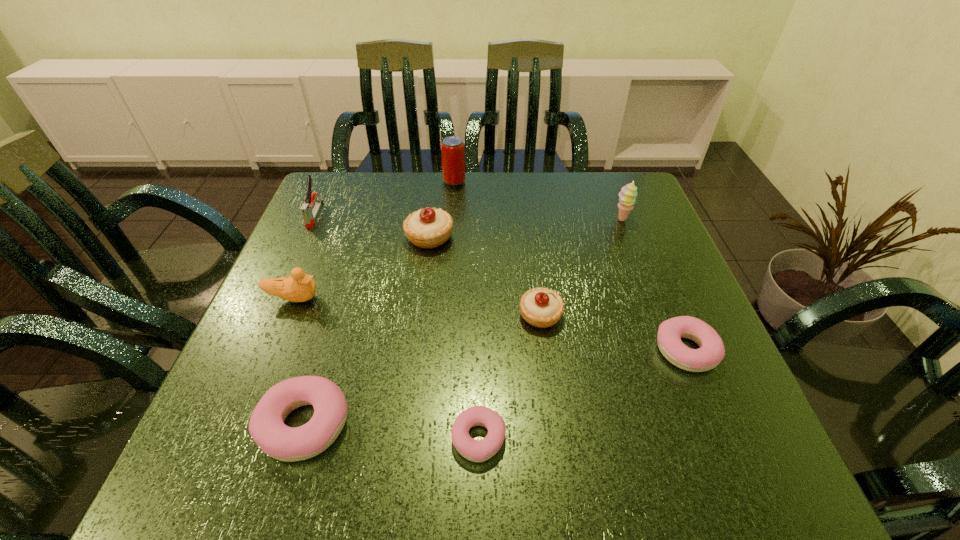
The image size is (960, 540). I want to click on vacant space located 0.110m on the right of the seventh object from left to right, so click(x=615, y=315).

Locate an element on the screen. This screenshot has width=960, height=540. free space located 0.290m on the back of the leftmost pastry is located at coordinates [x=350, y=275].

This screenshot has width=960, height=540. In order to click on blank space located on the left of the rightmost pink pastry in this screenshot , I will do `click(519, 350)`.

Identify the location of vacant area located 0.380m on the left of the shortest object. Image resolution: width=960 pixels, height=540 pixels. (218, 438).

The image size is (960, 540). Identify the location of beer can that is at the far edge. [x=452, y=148].

You are a GUI agent. You are given a task and a screenshot of the screen. Output one action in this format:
    pyautogui.click(x=<x>, y=<y>)
    Task: Click on the sherbert positioned at the far edge
    The width and height of the screenshot is (960, 540).
    Given the screenshot: What is the action you would take?
    pyautogui.click(x=627, y=196)

This screenshot has width=960, height=540. What are the coordinates of `stapler at the far edge` in the screenshot? It's located at (309, 216).

Find the location of a particular element. stapler at the left edge is located at coordinates (309, 216).

Locate an element on the screen. The image size is (960, 540). duckling that is at the left edge is located at coordinates (299, 287).

I want to click on pastry situated at the left edge, so click(266, 426).